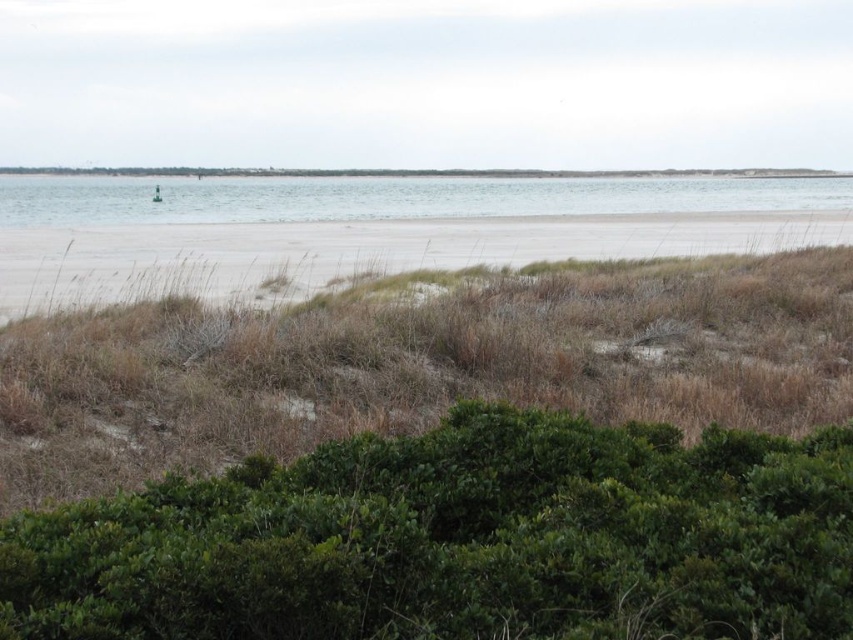
Who is positioned more to the left, green leafy bush at lower center or light beige sand at center?

→ green leafy bush at lower center

Does green leafy bush at lower center lie behind light beige sand at center?

That is False.

Is point (648, 500) in front of point (70, 237)?

Yes, it is.

You are a GUI agent. You are given a task and a screenshot of the screen. Output one action in this format:
    pyautogui.click(x=<x>, y=<y>)
    Task: Click on the green leafy bush at lower center
    
    Given the screenshot: What is the action you would take?
    pyautogui.click(x=459, y=540)

Measure the distance between green leafy bush at lower center and clear water at center.

green leafy bush at lower center is 187.43 feet from clear water at center.

Which is in front, point (523, 480) or point (311, 212)?

Point (523, 480) is more forward.

Where is `green leafy bush at lower center`? green leafy bush at lower center is located at coordinates (459, 540).

Is light beige sand at center thinner than clear water at center?

Indeed, light beige sand at center has a lesser width compared to clear water at center.

In the scene shown: Is light beige sand at center positioned before clear water at center?

Yes, it is.

Does point (112, 260) lie in front of point (779, 193)?

That is True.

Locate an element on the screen. The height and width of the screenshot is (640, 853). light beige sand at center is located at coordinates (357, 252).